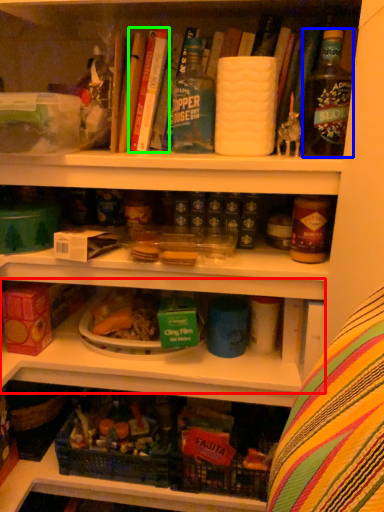
Question: Considering the real-world distances, which object is farthest from shelf (highlighted by a red box)? bottle (highlighted by a blue box) or book (highlighted by a green box)?

Choices:
 (A) bottle
 (B) book

Answer: (B)